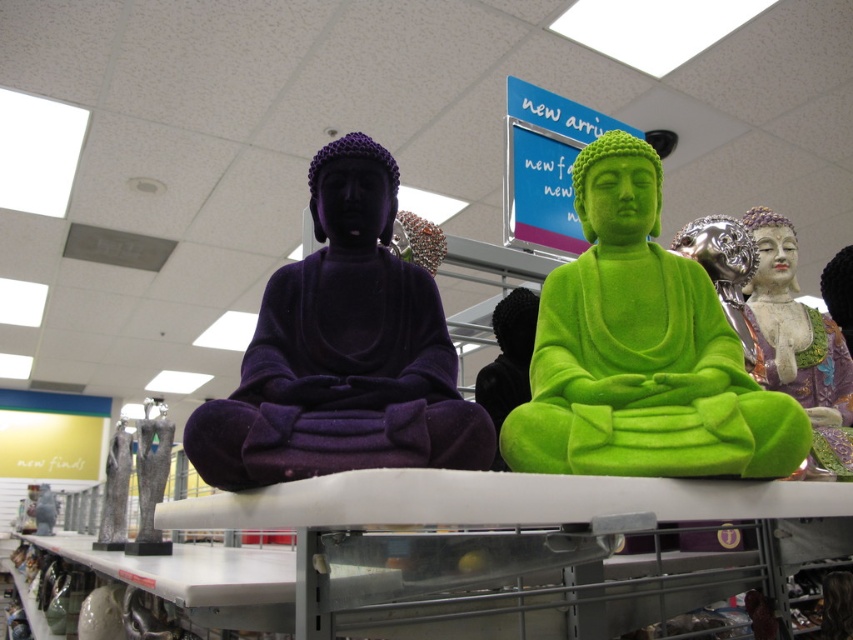
Question: Is gray marble statue at lower left wider than metallic silver vase at lower left?

Choices:
 (A) no
 (B) yes

Answer: (A)

Question: Is purple velvety monk at center smaller than gray marble statue at lower left?

Choices:
 (A) no
 (B) yes

Answer: (A)

Question: Does green fuzzy buddha at center have a smaller size compared to purple velvety monk at center?

Choices:
 (A) no
 (B) yes

Answer: (B)

Question: Which point appears closest to the camera in this image?

Choices:
 (A) 119,540
 (B) 415,392
 (C) 148,515
 (D) 645,433

Answer: (D)

Question: Which object appears closest to the camera in this image?

Choices:
 (A) gray marble statue at lower left
 (B) green fuzzy buddha at center
 (C) purple velvety monk at center

Answer: (C)

Question: Which point is farther to the camera?

Choices:
 (A) (361, 186)
 (B) (164, 419)

Answer: (B)